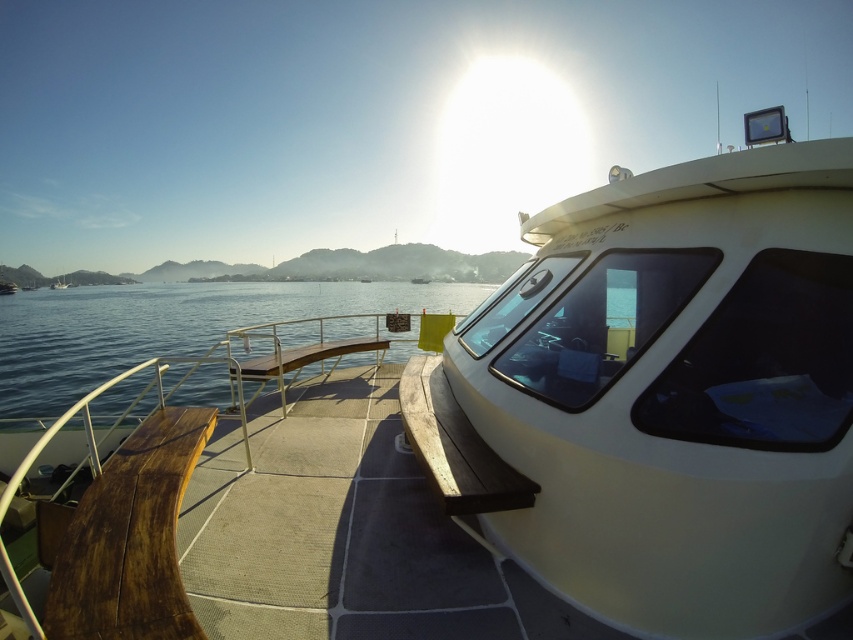
Question: Can you confirm if white matte boat at right is positioned below clear blue water at center?

Choices:
 (A) no
 (B) yes

Answer: (B)

Question: Which object appears farthest from the camera in this image?

Choices:
 (A) white matte boat at right
 (B) clear blue water at center

Answer: (B)

Question: Considering the relative positions of white matte boat at right and clear blue water at center in the image provided, where is white matte boat at right located with respect to clear blue water at center?

Choices:
 (A) right
 (B) left

Answer: (A)

Question: Which point is farther to the camera?

Choices:
 (A) white matte boat at right
 (B) clear blue water at center

Answer: (B)

Question: Is white matte boat at right positioned behind clear blue water at center?

Choices:
 (A) no
 (B) yes

Answer: (A)

Question: Among these objects, which one is farthest from the camera?

Choices:
 (A) clear blue water at center
 (B) white matte boat at right

Answer: (A)